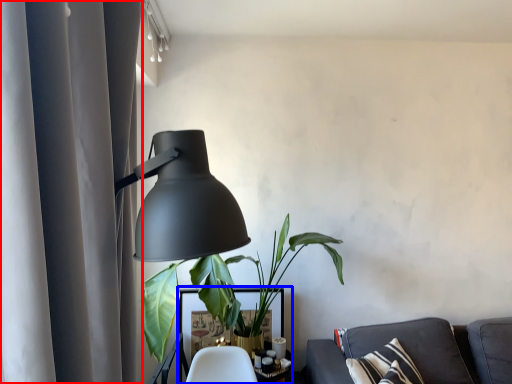
Question: Which of the following is the farthest to the observer, curtain (highlighted by a red box) or table (highlighted by a blue box)?

Choices:
 (A) curtain
 (B) table

Answer: (B)